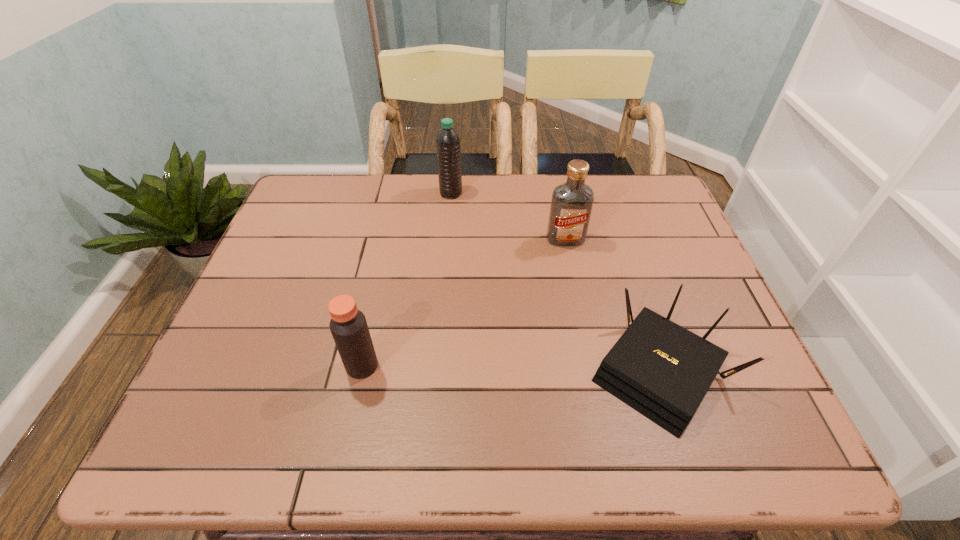
This screenshot has width=960, height=540. In the image, there is a desktop. Identify the location of free space at the near right corner. (749, 441).

At what (x,y) coordinates should I click in order to perform the action: click on free area in between the shortest object and the third tallest object. Please return your answer as a coordinate pair (x, y). This screenshot has height=540, width=960. Looking at the image, I should click on (512, 369).

Image resolution: width=960 pixels, height=540 pixels. Find the location of `vacant point located between the router and the third nearest object`. vacant point located between the router and the third nearest object is located at coordinates (613, 306).

Find the location of a particular element. vacant area that lies between the leftmost object and the second farthest object is located at coordinates (464, 302).

Locate an element on the screen. The image size is (960, 540). vacant space that is in between the water bottle and the leftmost object is located at coordinates (406, 280).

Locate an element on the screen. The image size is (960, 540). free area in between the shortest object and the vinegar is located at coordinates (512, 369).

At what (x,y) coordinates should I click in order to perform the action: click on free spot between the vinegar and the router. Please return your answer as a coordinate pair (x, y). This screenshot has height=540, width=960. Looking at the image, I should click on (512, 369).

Where is `vacant point located between the second object from left to right and the shortest object`? vacant point located between the second object from left to right and the shortest object is located at coordinates (556, 283).

You are a GUI agent. You are given a task and a screenshot of the screen. Output one action in this format:
    pyautogui.click(x=<x>, y=<y>)
    Task: Click on the empty location between the router and the second farthest object
    Image resolution: width=960 pixels, height=540 pixels.
    Given the screenshot: What is the action you would take?
    pyautogui.click(x=613, y=306)

Find the location of a particular element. This screenshot has height=540, width=960. vacant space that's between the second farthest object and the second shortest object is located at coordinates (464, 302).